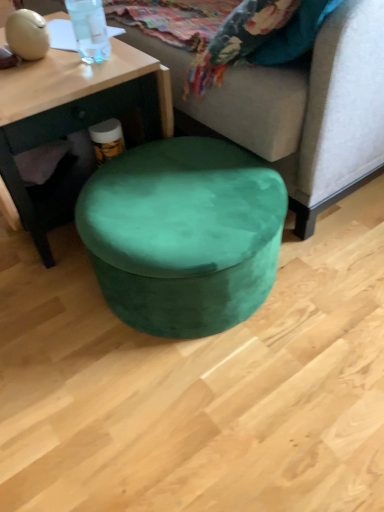
Question: Can you confirm if matte wood coffee table at center is shorter than velvet green ottoman at center?

Choices:
 (A) no
 (B) yes

Answer: (B)

Question: Is matte wood coffee table at center surrounding velvet green ottoman at center?

Choices:
 (A) no
 (B) yes

Answer: (A)

Question: Is matte wood coffee table at center aimed at velvet green ottoman at center?

Choices:
 (A) no
 (B) yes

Answer: (A)

Question: Is matte wood coffee table at center oriented away from velvet green ottoman at center?

Choices:
 (A) yes
 (B) no

Answer: (A)

Question: Considering the relative positions of matte wood coffee table at center and velvet green ottoman at center in the image provided, is matte wood coffee table at center to the left of velvet green ottoman at center from the viewer's perspective?

Choices:
 (A) no
 (B) yes

Answer: (B)

Question: From their relative heights in the image, would you say velvet green ottoman at center is taller or shorter than matte wood coffee table at center?

Choices:
 (A) tall
 (B) short

Answer: (B)

Question: Is point (226, 172) positioned closer to the camera than point (38, 142)?

Choices:
 (A) farther
 (B) closer

Answer: (A)

Question: From a real-world perspective, relative to matte wood coffee table at center, is velvet green ottoman at center vertically above or below?

Choices:
 (A) below
 (B) above

Answer: (A)

Question: Considering the positions of velvet green ottoman at center and matte wood coffee table at center in the image, is velvet green ottoman at center bigger or smaller than matte wood coffee table at center?

Choices:
 (A) big
 (B) small

Answer: (B)

Question: Is velvet green ottoman at center taller or shorter than transparent plastic bottle at upper left?

Choices:
 (A) short
 (B) tall

Answer: (B)

Question: Is velvet green ottoman at center in front of or behind transparent plastic bottle at upper left in the image?

Choices:
 (A) front
 (B) behind

Answer: (A)

Question: From the image's perspective, is velvet green ottoman at center above or below transparent plastic bottle at upper left?

Choices:
 (A) above
 (B) below

Answer: (A)

Question: Considering the positions of velvet green ottoman at center and transparent plastic bottle at upper left in the image, is velvet green ottoman at center bigger or smaller than transparent plastic bottle at upper left?

Choices:
 (A) big
 (B) small

Answer: (A)

Question: Looking at the image, does matte wood coffee table at center seem bigger or smaller compared to velvet green ottoman at center?

Choices:
 (A) big
 (B) small

Answer: (A)

Question: From the image's perspective, is matte wood coffee table at center above or below velvet green ottoman at center?

Choices:
 (A) above
 (B) below

Answer: (A)